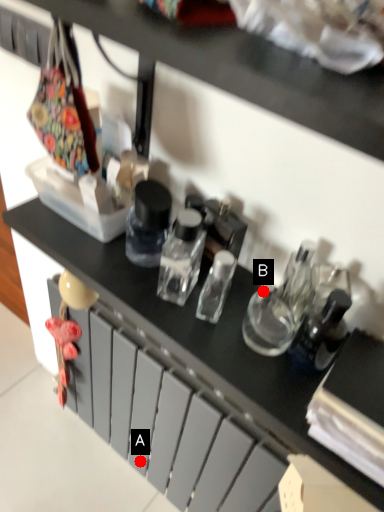
Question: Two points are circled on the image, labeled by A and B beside each circle. Among these points, which one is nearest to the camera?

Choices:
 (A) A is closer
 (B) B is closer

Answer: (B)